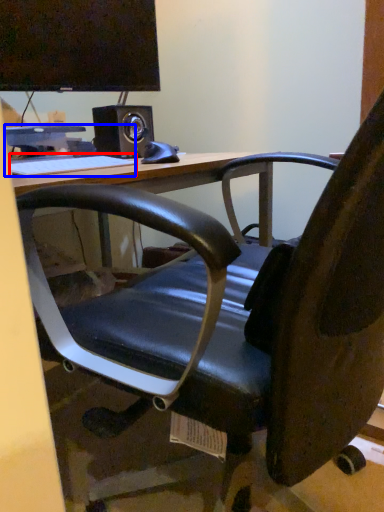
Question: Which point is closer to the camera, keyboard (highlighted by a red box) or computer (highlighted by a blue box)?

Choices:
 (A) keyboard
 (B) computer

Answer: (A)